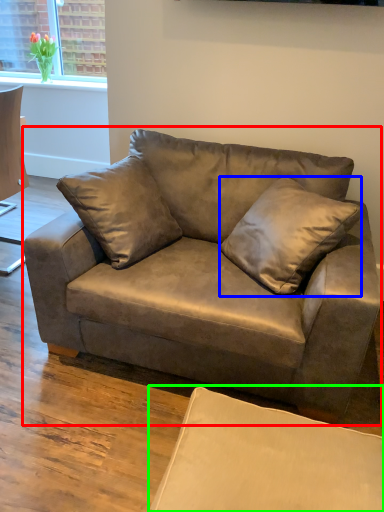
Question: Which object is positioned closest to studio couch (highlighted by a red box)? Select from pillow (highlighted by a blue box) and swivel chair (highlighted by a green box).

Choices:
 (A) pillow
 (B) swivel chair

Answer: (A)